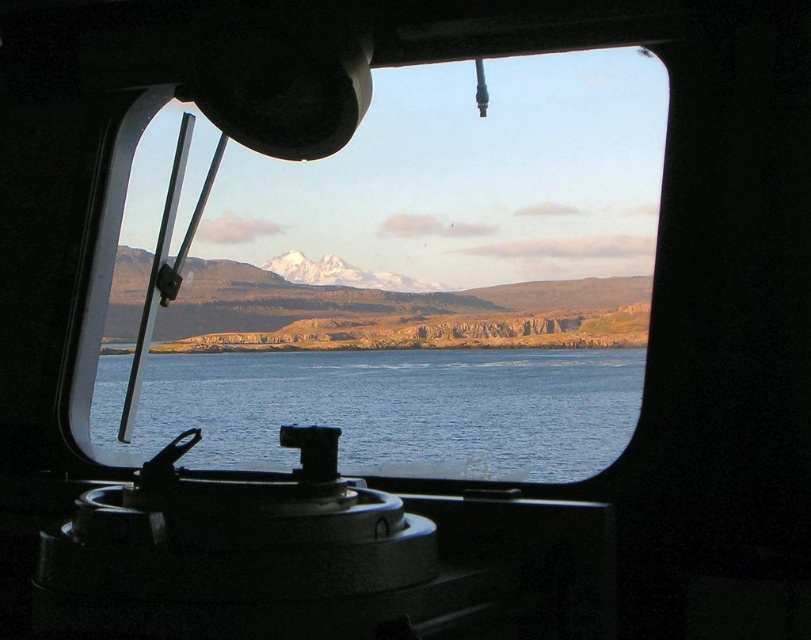
Who is lower down, transparent glass window at center or snowy rock mountain at center?

transparent glass window at center is below.

Describe the element at coordinates (402, 278) in the screenshot. I see `transparent glass window at center` at that location.

Does point (611, 269) lie in front of point (191, 324)?

Yes, it is in front of point (191, 324).

Locate an element on the screen. The image size is (811, 640). transparent glass window at center is located at coordinates (402, 278).

From the picture: Can you confirm if transparent glass window at center is bigger than blue water at center?

Yes, transparent glass window at center is bigger than blue water at center.

Between point (483, 342) and point (447, 468), which one is positioned behind?

Positioned behind is point (483, 342).

This screenshot has width=811, height=640. I want to click on transparent glass window at center, so click(x=402, y=278).

Between point (97, 422) and point (136, 314), which one is positioned behind?

Positioned behind is point (136, 314).

Find the location of `blue water at center`. blue water at center is located at coordinates click(385, 408).

Where is `blue water at center`? The height and width of the screenshot is (640, 811). blue water at center is located at coordinates (385, 408).